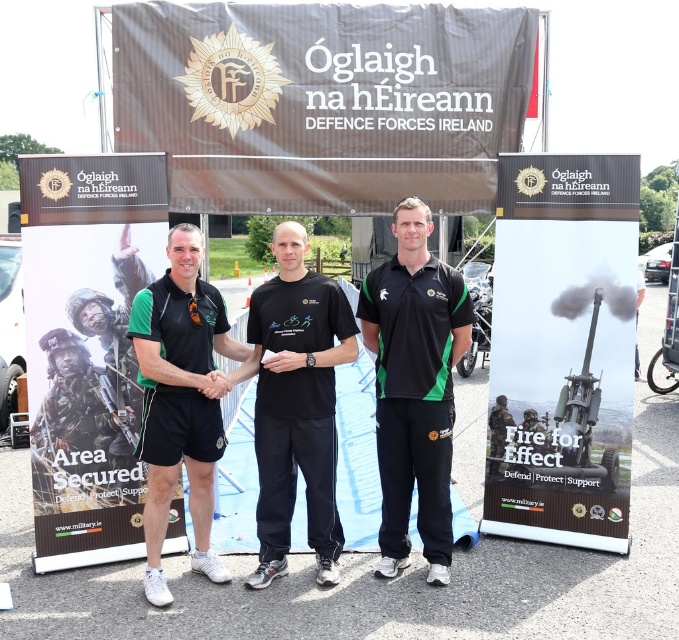
You are a photographer positioned at the center of the scene. You want to capture a photo that includes both the point at (318,406) and the point at (179,355). However, you notice that one of the points is partially obscured by another object. Which point is more likely to be visible in your photo?

Point (179,355) is more likely to be visible because it is in front of point (318,406), which is behind it.

What is the exact coordinate of the black matte polo shirt at center in the image?

The black matte polo shirt at center is located at point (414, 387).